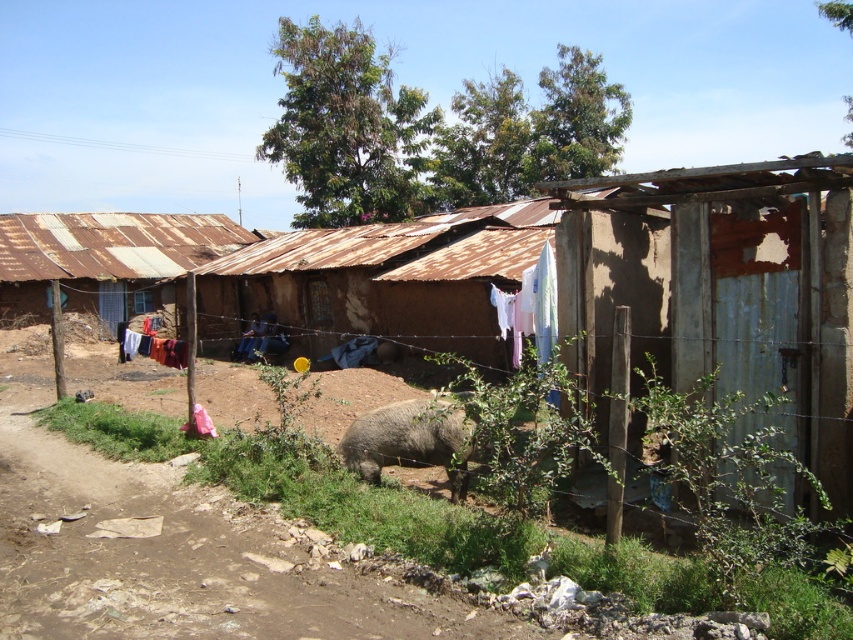
Question: Among these points, which one is farthest from the camera?

Choices:
 (A) (157, 353)
 (B) (100, 344)

Answer: (B)

Question: Is wire mesh at center wider than gray matte pig at center?

Choices:
 (A) no
 (B) yes

Answer: (B)

Question: Can you confirm if rusty metal hut at center is positioned above wire mesh at center?

Choices:
 (A) no
 (B) yes

Answer: (B)

Question: Which of the following is the closest to the observer?

Choices:
 (A) (248, 419)
 (B) (32, 248)
 (C) (144, 349)

Answer: (A)

Question: From the image, what is the correct spatial relationship of rusty metal hut at center in relation to gray matte pig at center?

Choices:
 (A) right
 (B) left

Answer: (B)

Question: Which point is closer to the camera taking this photo?

Choices:
 (A) [x=457, y=429]
 (B) [x=184, y=342]
 (C) [x=35, y=364]
 (D) [x=100, y=220]

Answer: (A)